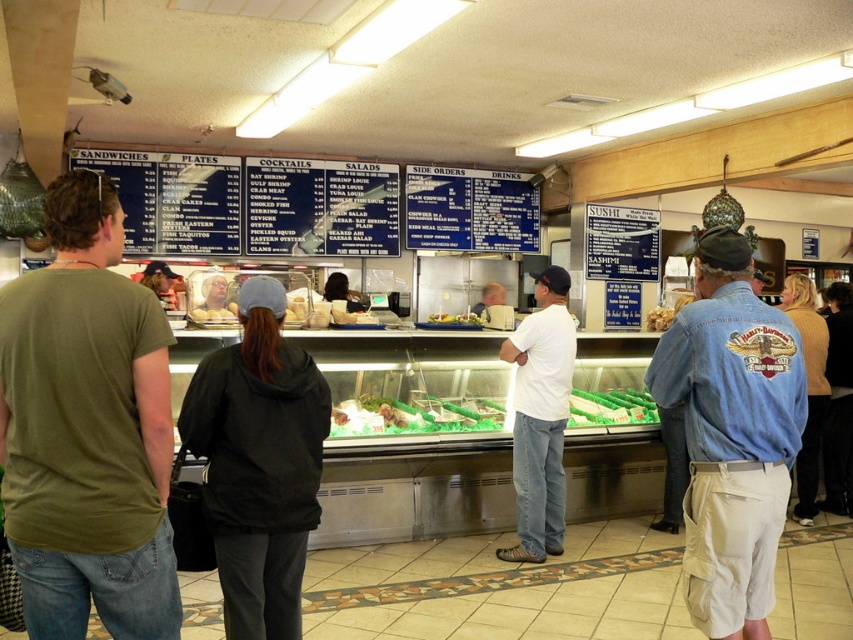
Does blue denim jacket at lower right have a lesser width compared to green plastic tray at center?

Correct, blue denim jacket at lower right's width is less than green plastic tray at center's.

Does blue denim jacket at lower right appear under green plastic tray at center?

No, blue denim jacket at lower right is not below green plastic tray at center.

Is point (814, 454) less distant than point (405, 406)?

No, (814, 454) is behind (405, 406).

Find the location of a particular element. blue denim jacket at lower right is located at coordinates (808, 388).

Is denim shirt at right to the left of black leather jacket at lower right from the viewer's perspective?

Yes, denim shirt at right is to the left of black leather jacket at lower right.

Which is in front, point (744, 531) or point (840, 460)?

Positioned in front is point (744, 531).

Where is `denim shirt at right`? denim shirt at right is located at coordinates (730, 435).

Looking at this image, can you confirm if white matte shirt at center is taller than black leather jacket at lower right?

No, white matte shirt at center is not taller than black leather jacket at lower right.

Is white matte shirt at center below black leather jacket at lower right?

No, white matte shirt at center is not below black leather jacket at lower right.

Is point (564, 342) farther from camera compared to point (846, 292)?

No, it is not.

In order to click on white matte shirt at center in this screenshot , I will do click(540, 417).